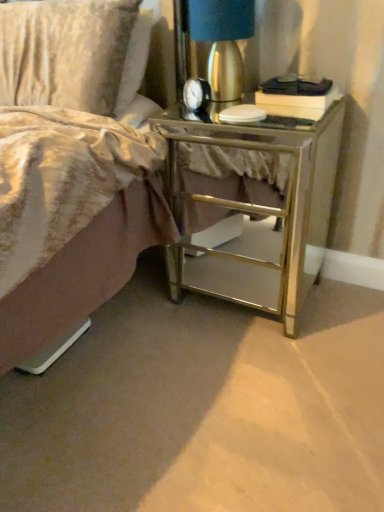
Question: Would you say mirrored glass nightstand at lower right contains velvety gold pillow at upper left?

Choices:
 (A) yes
 (B) no

Answer: (B)

Question: Is mirrored glass nightstand at lower right smaller than velvety gold pillow at upper left?

Choices:
 (A) no
 (B) yes

Answer: (A)

Question: Is mirrored glass nightstand at lower right not inside velvety gold pillow at upper left?

Choices:
 (A) yes
 (B) no

Answer: (A)

Question: Considering the relative positions of mirrored glass nightstand at lower right and velvety gold pillow at upper left in the image provided, is mirrored glass nightstand at lower right to the right of velvety gold pillow at upper left from the viewer's perspective?

Choices:
 (A) no
 (B) yes

Answer: (B)

Question: Considering the relative sizes of mirrored glass nightstand at lower right and velvety gold pillow at upper left in the image provided, is mirrored glass nightstand at lower right taller than velvety gold pillow at upper left?

Choices:
 (A) yes
 (B) no

Answer: (A)

Question: From the image's perspective, is mirrored glass nightstand at lower right located beneath velvety gold pillow at upper left?

Choices:
 (A) no
 (B) yes

Answer: (B)

Question: Does velvety gold pillow at upper left appear on the right side of mirrored glass nightstand at lower right?

Choices:
 (A) yes
 (B) no

Answer: (B)

Question: Is velvety gold pillow at upper left facing towards mirrored glass nightstand at lower right?

Choices:
 (A) no
 (B) yes

Answer: (A)

Question: From a real-world perspective, is velvety gold pillow at upper left below mirrored glass nightstand at lower right?

Choices:
 (A) no
 (B) yes

Answer: (A)

Question: Is velvety gold pillow at upper left at the left side of mirrored glass nightstand at lower right?

Choices:
 (A) no
 (B) yes

Answer: (B)

Question: Can you confirm if velvety gold pillow at upper left is smaller than mirrored glass nightstand at lower right?

Choices:
 (A) yes
 (B) no

Answer: (A)

Question: From the image's perspective, is velvety gold pillow at upper left under mirrored glass nightstand at lower right?

Choices:
 (A) no
 (B) yes

Answer: (A)

Question: Considering the relative sizes of mirrored glass nightstand at lower right and metallic gold lamp at upper right in the image provided, is mirrored glass nightstand at lower right thinner than metallic gold lamp at upper right?

Choices:
 (A) no
 (B) yes

Answer: (A)